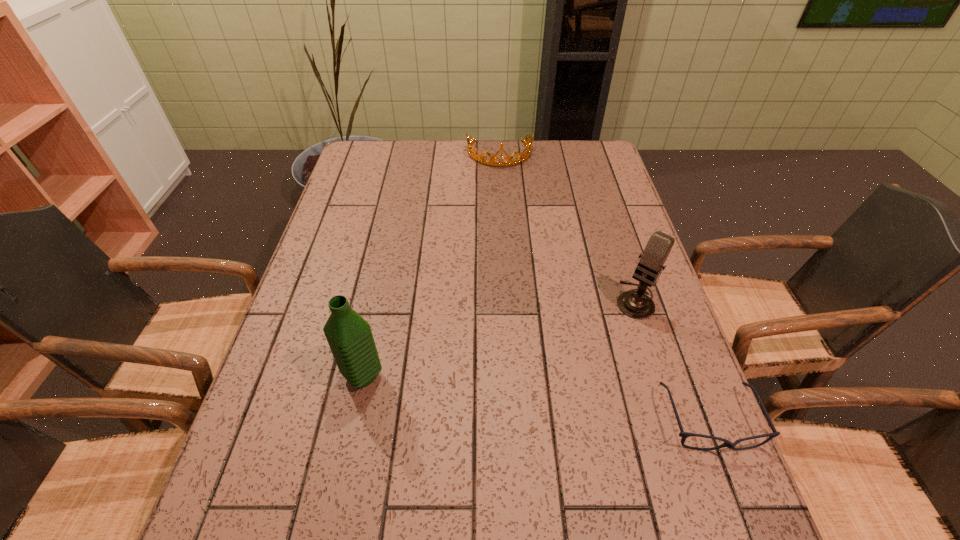
I want to click on free space located on the front-facing side of the third nearest object, so click(574, 376).

Find the location of a particular element. The height and width of the screenshot is (540, 960). free space located on the front-facing side of the third nearest object is located at coordinates (577, 374).

I want to click on object present at the far edge, so click(x=519, y=158).

The width and height of the screenshot is (960, 540). In order to click on object that is at the near edge in this screenshot , I will do `click(684, 435)`.

Locate an element on the screen. The height and width of the screenshot is (540, 960). object positioned at the left edge is located at coordinates (350, 338).

You are a GUI agent. You are given a task and a screenshot of the screen. Output one action in this format:
    pyautogui.click(x=<x>, y=<y>)
    Task: Click on the spectacles that is at the right edge
    Image resolution: width=960 pixels, height=540 pixels.
    Given the screenshot: What is the action you would take?
    click(684, 435)

The width and height of the screenshot is (960, 540). Find the location of `microphone present at the right edge`. microphone present at the right edge is located at coordinates (636, 304).

Find the location of a particular element. This screenshot has width=960, height=540. object present at the near right corner is located at coordinates (684, 435).

The width and height of the screenshot is (960, 540). I want to click on vacant space at the far edge of the desktop, so click(546, 163).

Where is `free location at the left edge`? This screenshot has width=960, height=540. free location at the left edge is located at coordinates (368, 200).